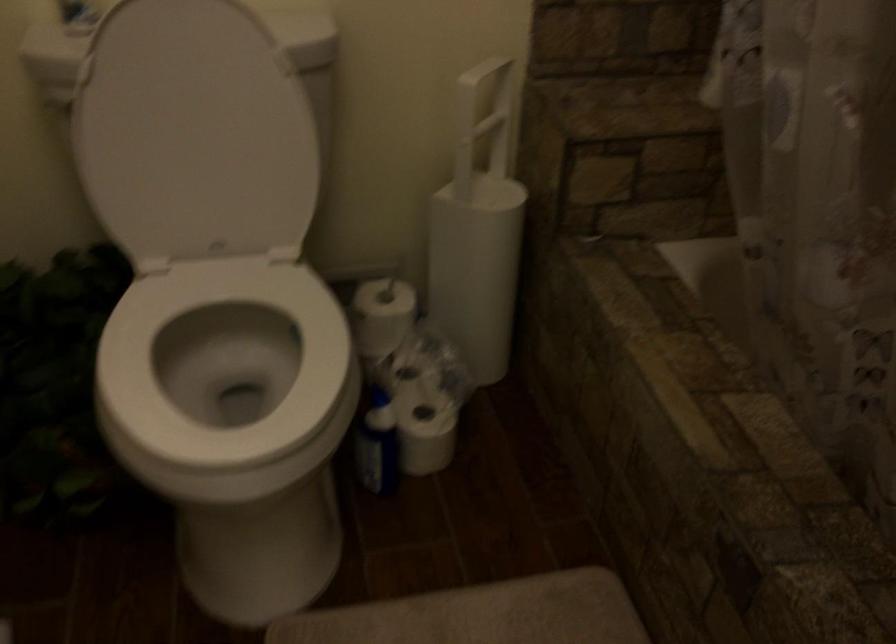
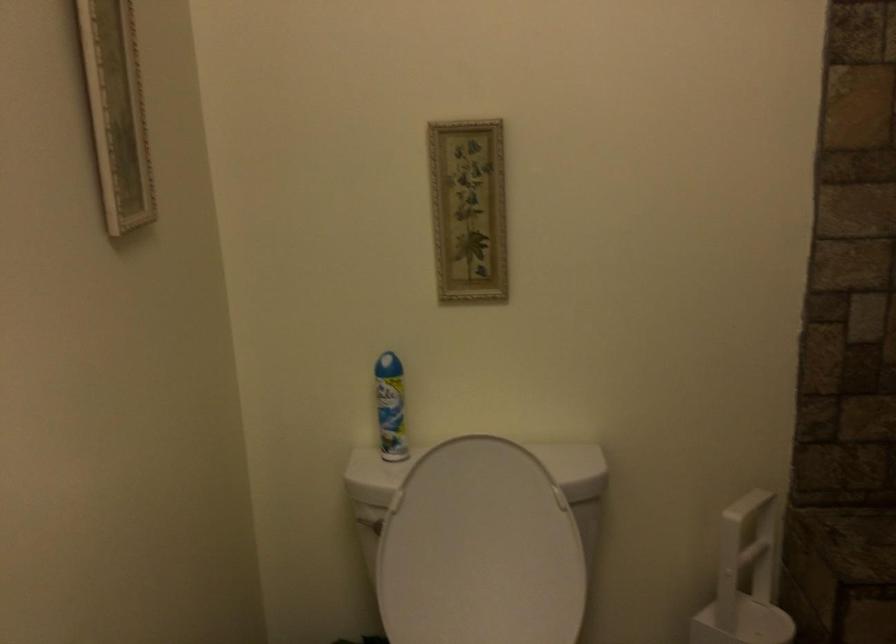
Based on the photo, based on the continuous images, in which direction is the camera rotating?

The camera's rotation is toward left-up.